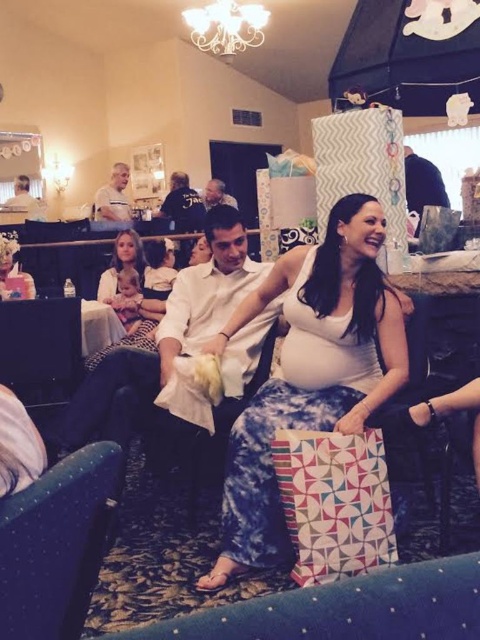
The image size is (480, 640). What do you see at coordinates (311, 371) in the screenshot?
I see `white matte dress at center` at bounding box center [311, 371].

Between point (351, 404) and point (213, 193), which one is positioned in front?

Point (351, 404) is more forward.

You are a GUI agent. You are given a task and a screenshot of the screen. Output one action in this format:
    pyautogui.click(x=<x>, y=<y>)
    Task: Click on the white matte dress at center
    The height and width of the screenshot is (640, 480).
    Given the screenshot: What is the action you would take?
    pyautogui.click(x=311, y=371)

Can you confirm if geometric-patterned paper bag at center is thinner than white matte shirt at upper left?

Correct, geometric-patterned paper bag at center's width is less than white matte shirt at upper left's.

Can you confirm if geometric-patterned paper bag at center is positioned to the right of white matte shirt at upper left?

Correct, you'll find geometric-patterned paper bag at center to the right of white matte shirt at upper left.

Measure the distance between point (x=310, y=456) and camera.

Point (x=310, y=456) is 1.92 meters away from camera.

Identify the location of geometric-patterned paper bag at center. The width and height of the screenshot is (480, 640). (335, 502).

Who is more distant from viewer, (x=355, y=339) or (x=128, y=204)?

The point (x=128, y=204) is more distant.

Measure the distance from matte white belly at center to white matte shirt at upper left.

The distance of matte white belly at center from white matte shirt at upper left is 5.32 meters.

Image resolution: width=480 pixels, height=640 pixels. Identify the location of matte white belly at center. click(326, 356).

This screenshot has height=640, width=480. I want to click on matte white belly at center, so click(326, 356).